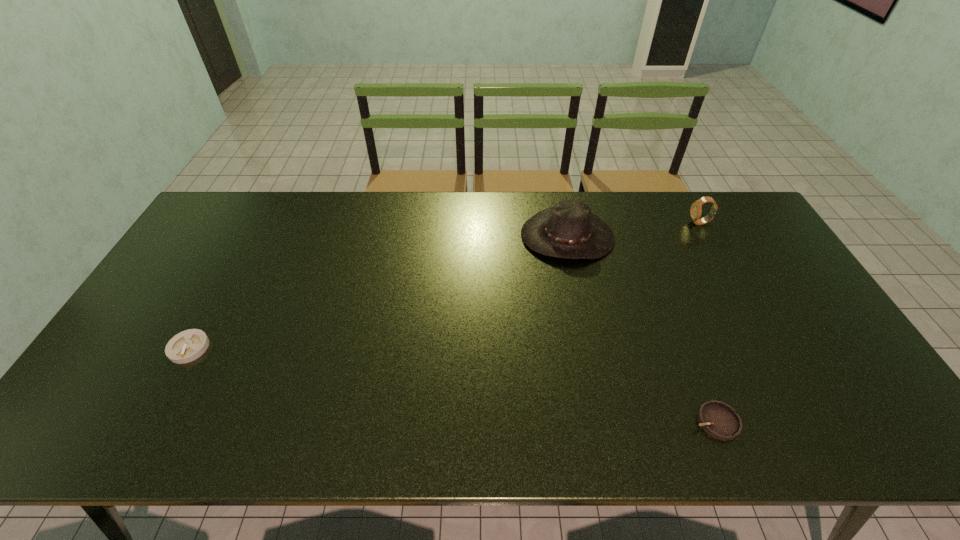
Locate an element on the screen. free spot between the nearest object and the third farthest object is located at coordinates coord(452,384).

The height and width of the screenshot is (540, 960). Find the location of `free spot between the nearest object and the left ashtray`. free spot between the nearest object and the left ashtray is located at coordinates (452, 384).

Find the location of `free space between the rightmost object and the hat`. free space between the rightmost object and the hat is located at coordinates (634, 230).

Find the location of a particular element. The image size is (960, 540). object that stands as the closest to the third object from right to left is located at coordinates tap(696, 208).

Identify which object is the closest to the hat. Please provide its 2D coordinates. Your answer should be formatted as a tuple, i.e. [(x, y)], where the tuple contains the x and y coordinates of a point satisfying the conditions above.

[(696, 208)]

The height and width of the screenshot is (540, 960). Find the location of `free space that satisfies the following two spatial constraints: 1. on the front side of the left ashtray; 2. on the right side of the third object from left to right`. free space that satisfies the following two spatial constraints: 1. on the front side of the left ashtray; 2. on the right side of the third object from left to right is located at coordinates (149, 422).

This screenshot has height=540, width=960. I want to click on free spot that satisfies the following two spatial constraints: 1. on the face of the rightmost object; 2. on the front side of the leftmost object, so click(768, 348).